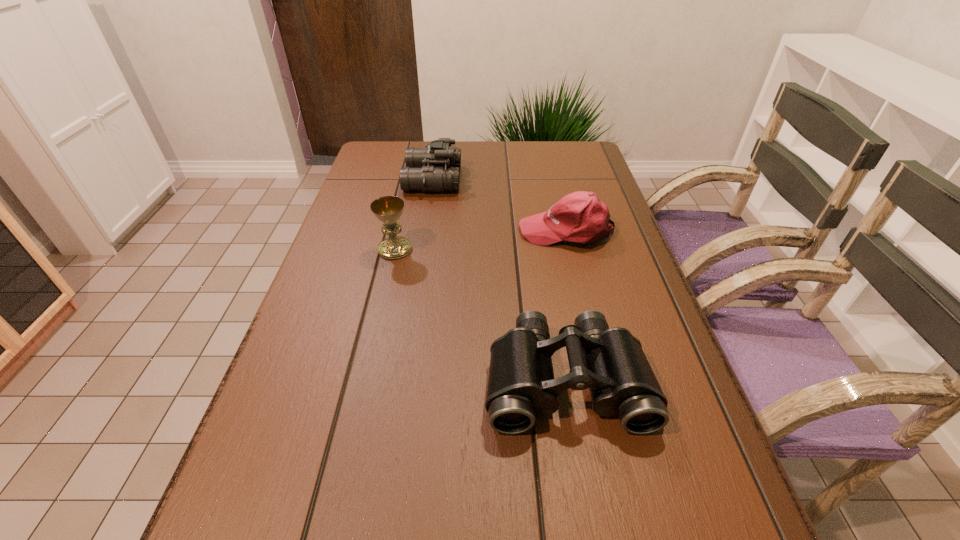
Locate an element on the screen. This screenshot has height=540, width=960. vacant point located at the front of the baseball cap with the brim is located at coordinates (442, 231).

What are the coordinates of `vacant area situated at the front of the baseball cap with the brim` in the screenshot? It's located at (495, 231).

At what (x,y) coordinates should I click in order to perform the action: click on object at the far edge. Please return your answer as a coordinate pair (x, y). The width and height of the screenshot is (960, 540). Looking at the image, I should click on (435, 168).

Image resolution: width=960 pixels, height=540 pixels. I want to click on chalice that is at the left edge, so click(x=388, y=209).

Identify the location of binoculars present at the left edge. This screenshot has height=540, width=960. (435, 168).

Identify the location of binoculars that is at the right edge. Image resolution: width=960 pixels, height=540 pixels. (610, 362).

At what (x,y) coordinates should I click in order to perform the action: click on baseball cap that is at the right edge. Please return your answer as a coordinate pair (x, y). This screenshot has width=960, height=540. Looking at the image, I should click on (580, 217).

Identify the location of object at the far left corner. tap(435, 168).

Find the location of a particular element. The height and width of the screenshot is (540, 960). free spot at the far edge of the desktop is located at coordinates tap(524, 152).

In the image, there is a desktop. Identify the location of vacant area at the left edge. (378, 304).